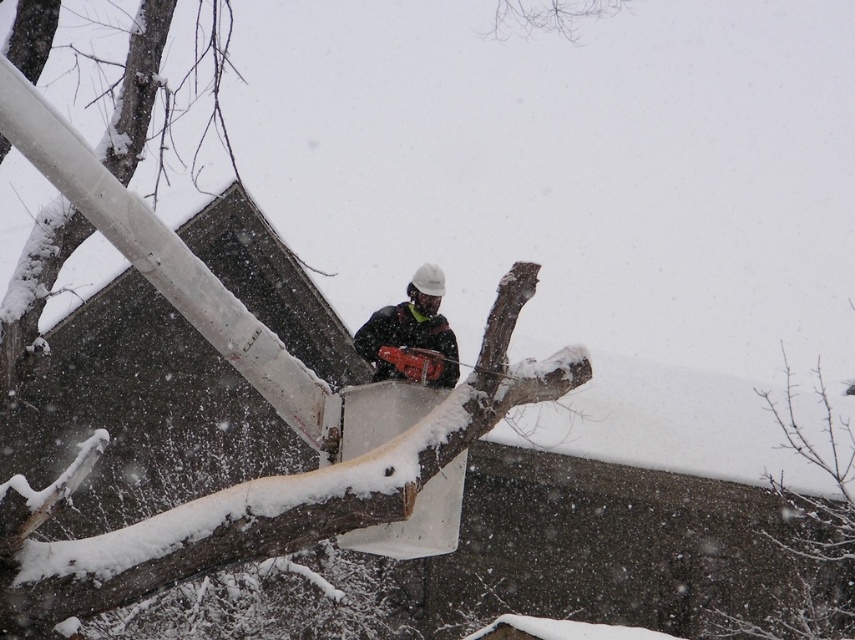
You are a safety inspector observing the worker in the snowy scene. The worker is using the matte black chainsaw at center to cut the brown rough wood at center. According to safety protocols, the chainsaw should be positioned above the wood to ensure proper visibility and control. Is the worker complying with this requirement?

The brown rough wood at center is below the matte black chainsaw at center, which means the chainsaw is positioned above the wood. This aligns with safety protocols requiring the chainsaw to be above the wood for proper visibility and control, so the worker is complying with the requirement.